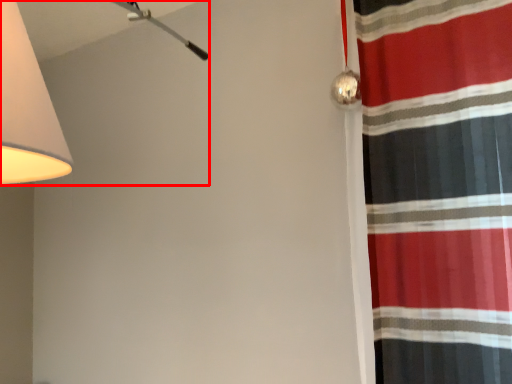
Question: From the image's perspective, what is the correct spatial positioning of lamp (annotated by the red box) in reference to curtain?

Choices:
 (A) below
 (B) above

Answer: (B)